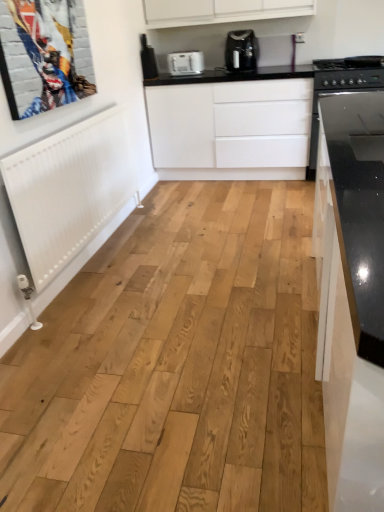
Question: Would you say white plastic toaster at upper center contains white matte cabinet at center?

Choices:
 (A) no
 (B) yes

Answer: (A)

Question: Is white plastic toaster at upper center bigger than white matte cabinet at center?

Choices:
 (A) yes
 (B) no

Answer: (B)

Question: Can you confirm if white plastic toaster at upper center is smaller than white matte cabinet at center?

Choices:
 (A) yes
 (B) no

Answer: (A)

Question: Is white matte cabinet at center at the back of white plastic toaster at upper center?

Choices:
 (A) yes
 (B) no

Answer: (B)

Question: From the image's perspective, is white plastic toaster at upper center above white matte cabinet at center?

Choices:
 (A) yes
 (B) no

Answer: (A)

Question: Considering their positions, is white plastic toaster at upper center located in front of or behind satin black coffee maker at upper center?

Choices:
 (A) behind
 (B) front

Answer: (A)

Question: From a real-world perspective, relative to satin black coffee maker at upper center, is white plastic toaster at upper center vertically above or below?

Choices:
 (A) above
 (B) below

Answer: (B)

Question: Is white plastic toaster at upper center wider or thinner than satin black coffee maker at upper center?

Choices:
 (A) wide
 (B) thin

Answer: (B)

Question: From the image's perspective, is white plastic toaster at upper center positioned above or below satin black coffee maker at upper center?

Choices:
 (A) below
 (B) above

Answer: (A)

Question: Is metallic silver picture frame at upper left taller or shorter than satin black coffee maker at upper center?

Choices:
 (A) short
 (B) tall

Answer: (B)

Question: Based on their sizes in the image, would you say metallic silver picture frame at upper left is bigger or smaller than satin black coffee maker at upper center?

Choices:
 (A) small
 (B) big

Answer: (A)

Question: From the image's perspective, relative to satin black coffee maker at upper center, is metallic silver picture frame at upper left above or below?

Choices:
 (A) above
 (B) below

Answer: (B)

Question: Is metallic silver picture frame at upper left inside or outside of satin black coffee maker at upper center?

Choices:
 (A) outside
 (B) inside

Answer: (A)

Question: Considering their positions, is white matte cabinet at center located in front of or behind black glass stove at right?

Choices:
 (A) front
 (B) behind

Answer: (B)

Question: Would you say white matte cabinet at center is to the left or to the right of black glass stove at right in the picture?

Choices:
 (A) right
 (B) left

Answer: (B)